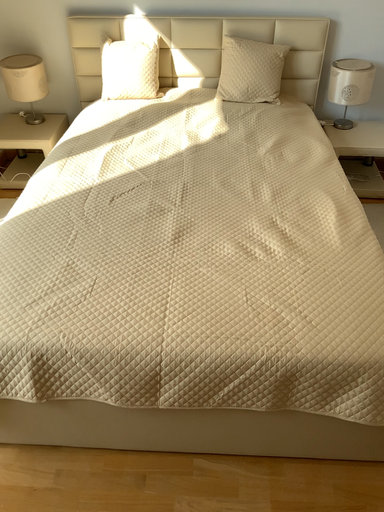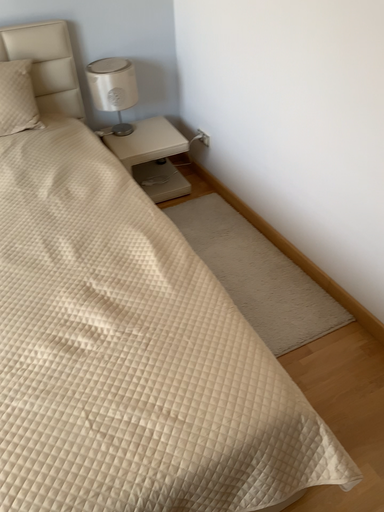
Question: Which way did the camera rotate in the video?

Choices:
 (A) rotated right
 (B) rotated left

Answer: (A)